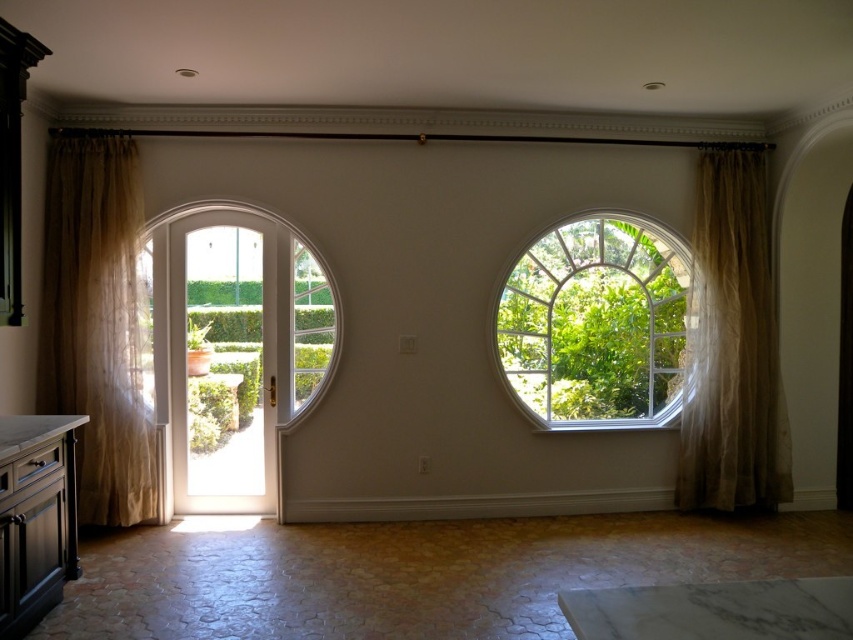
Question: From the image, what is the correct spatial relationship of clear glass window at center in relation to sheer beige curtain at right?

Choices:
 (A) below
 (B) above

Answer: (A)

Question: Among these points, which one is nearest to the camera?

Choices:
 (A) click(735, 298)
 (B) click(100, 458)

Answer: (B)

Question: Is sheer beige curtain at left to the left of sheer beige curtain at right from the viewer's perspective?

Choices:
 (A) yes
 (B) no

Answer: (A)

Question: Which point appears closest to the camera in this image?

Choices:
 (A) 698,508
 (B) 125,358

Answer: (B)

Question: Considering the real-world distances, which object is closest to the sheer beige curtain at left?

Choices:
 (A) clear glass window at center
 (B) clear glass door at center
 (C) sheer beige curtain at right

Answer: (B)

Question: Is sheer beige curtain at left smaller than clear glass door at center?

Choices:
 (A) no
 (B) yes

Answer: (A)